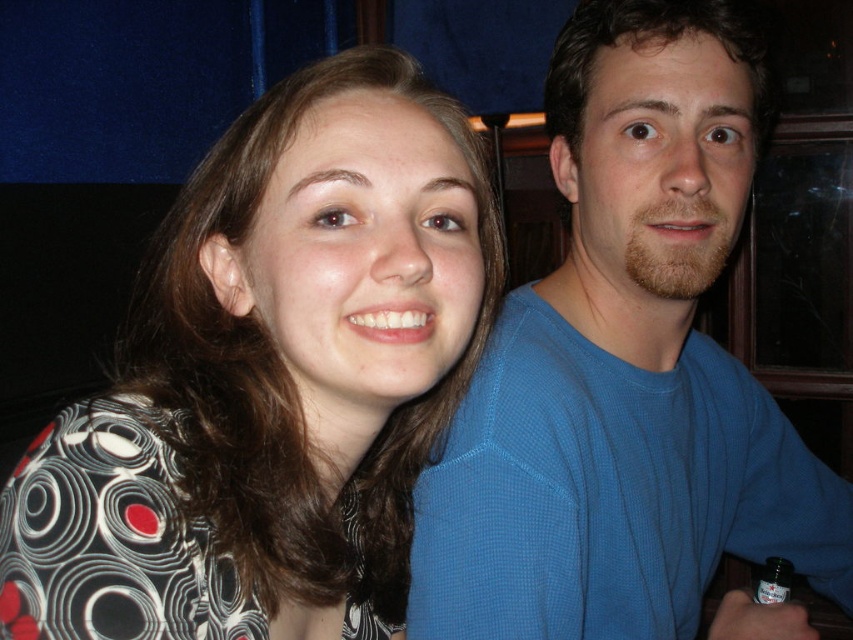
You are a photographer taking a group photo and want to ensure that both the patterned fabric shirt at center and the blue textured shirt at upper right are visible in the frame. Based on their positions, which shirt should you focus on to ensure both are in focus?

You should focus on the patterned fabric shirt at center because it is closer to the viewer than the blue textured shirt at upper right. By focusing on the closer object, both shirts will be in focus as the depth of field will cover the distance between them.

You are a fashion designer observing the two shirts in the image. The patterned fabric shirt at center has a unique design with circular patterns. The blue textured shirt at upper right has a ribbed texture. Which shirt is shorter in length?

The patterned fabric shirt at center is shorter than the blue textured shirt at upper right.

You are a photographer taking a picture of two people. The two subjects are wearing the patterned fabric shirt at center and the blue textured shirt at upper right. You want to ensure there is enough space between them for a clear photo. The minimum required distance for your camera is 10 inches. Can you confirm if the current spacing between them meets this requirement?

The patterned fabric shirt at center and blue textured shirt at upper right are 10.28 inches apart, which exceeds the minimum required distance of 10 inches. Therefore, the current spacing between them meets the requirement for a clear photo.